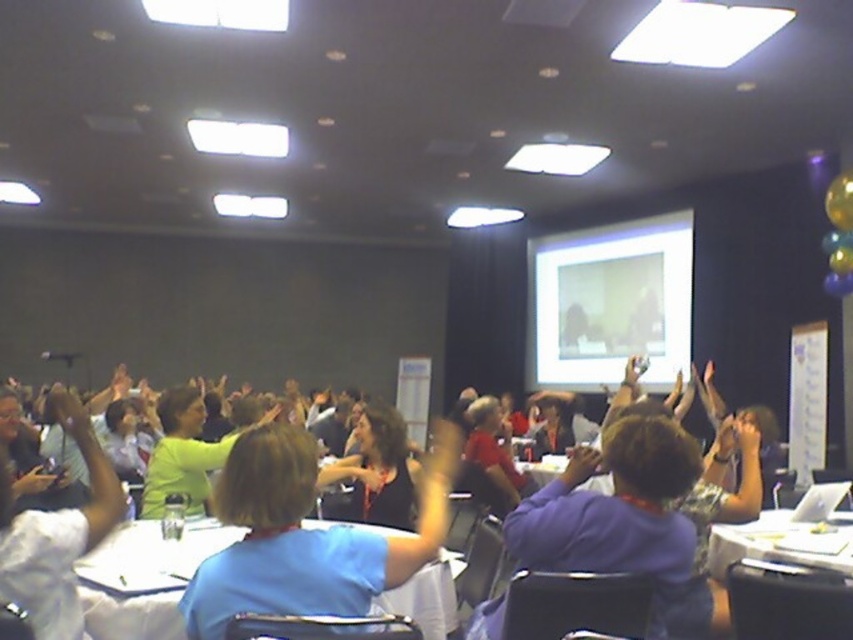
Question: Where is white glossy projector screen at upper center located in relation to white paper at center in the image?

Choices:
 (A) left
 (B) right

Answer: (B)

Question: Which point is farther to the camera?

Choices:
 (A) (724, 552)
 (B) (350, 580)

Answer: (A)

Question: Does white glossy projector screen at upper center appear under white paper at center?

Choices:
 (A) no
 (B) yes

Answer: (A)

Question: Is blue fabric shirt at center thinner than white glossy projector screen at upper center?

Choices:
 (A) no
 (B) yes

Answer: (B)

Question: Which is farther from the white glossy projector screen at upper center?

Choices:
 (A) blue fabric shirt at center
 (B) matte black shirt at center
 (C) white paper at center

Answer: (A)

Question: Which point is farther to the camera?

Choices:
 (A) (422, 500)
 (B) (575, 243)

Answer: (B)